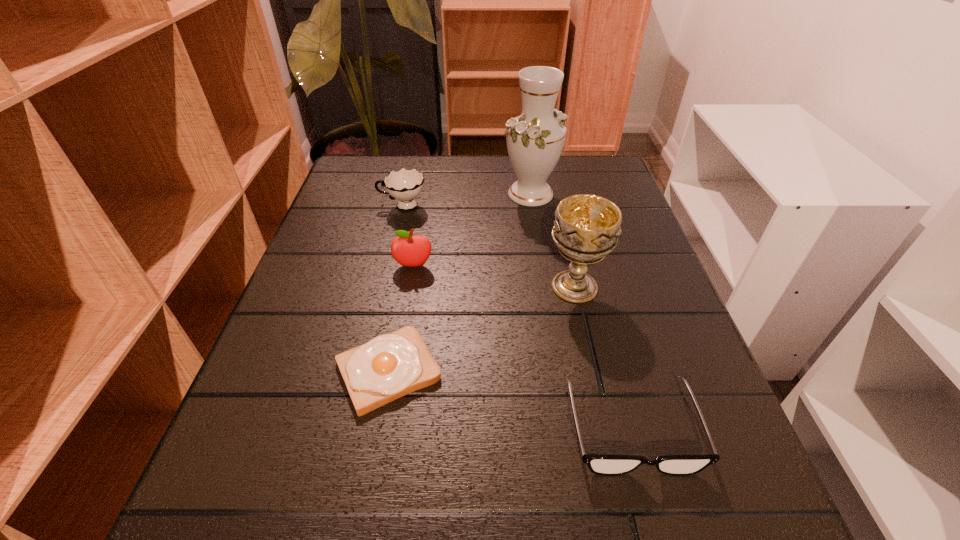
Where is `vacant space situated 0.090m on the side of the cup with the handle`? This screenshot has width=960, height=540. vacant space situated 0.090m on the side of the cup with the handle is located at coordinates (341, 206).

Find the location of `free region located 0.080m on the side of the cup with the handle`. free region located 0.080m on the side of the cup with the handle is located at coordinates [345, 206].

You are a GUI agent. You are given a task and a screenshot of the screen. Output one action in this format:
    pyautogui.click(x=<x>, y=<y>)
    Task: Click on the vacant space located on the right of the toast
    This screenshot has width=960, height=540.
    Given the screenshot: What is the action you would take?
    pyautogui.click(x=560, y=370)

Locate an element on the screen. The width and height of the screenshot is (960, 540). vase that is positioned at the far edge is located at coordinates (535, 139).

Where is `cup positioned at the far edge`? cup positioned at the far edge is located at coordinates [x=405, y=185].

Find the location of `cup that is positioned at the left edge`. cup that is positioned at the left edge is located at coordinates (405, 185).

The height and width of the screenshot is (540, 960). I want to click on toast located in the left edge section of the desktop, so click(390, 366).

You are a GUI agent. You are given a task and a screenshot of the screen. Output one action in this format:
    pyautogui.click(x=<x>, y=<y>)
    Task: Click on the vase that is positioned at the right edge
    
    Given the screenshot: What is the action you would take?
    pyautogui.click(x=535, y=139)

I want to click on chalice located at the right edge, so click(586, 228).

Where is `spectacles at the right edge`? spectacles at the right edge is located at coordinates (607, 465).